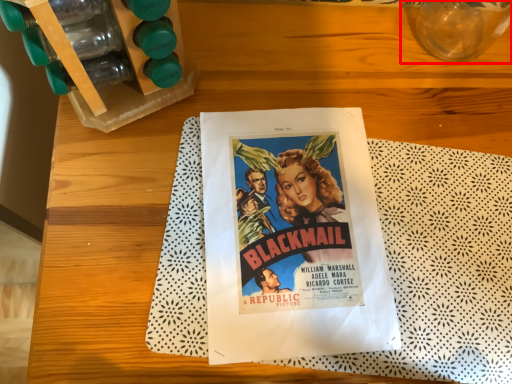
Question: From the image's perspective, considering the relative positions of glass vase (annotated by the red box) and paperback book in the image provided, where is glass vase (annotated by the red box) located with respect to the staircase?

Choices:
 (A) above
 (B) below

Answer: (A)